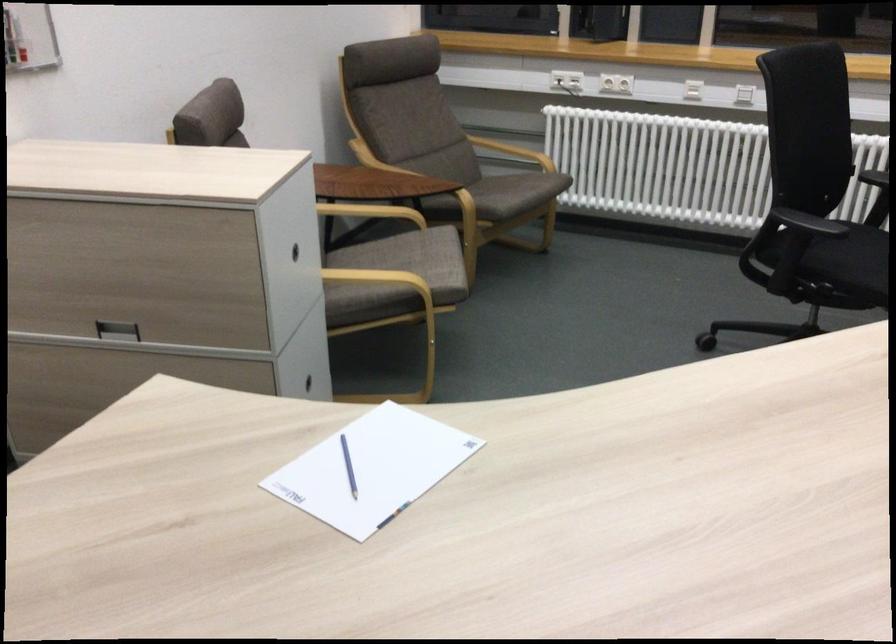
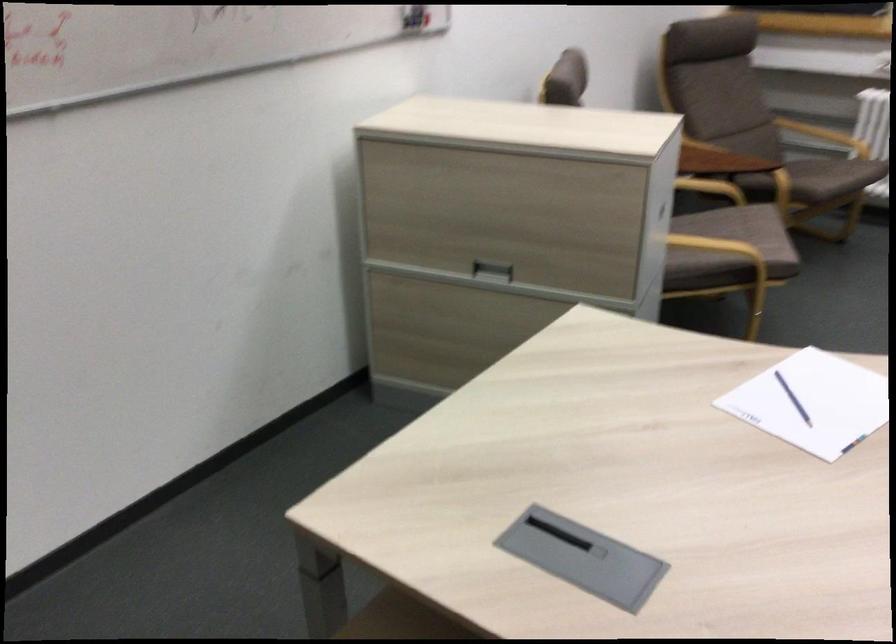
Question: The camera is either moving clockwise (left) or counter-clockwise (right) around the object. The first image is from the beginning of the video and the second image is from the end. Is the camera moving left or right when shooting the video?

Choices:
 (A) Left
 (B) Right

Answer: (B)